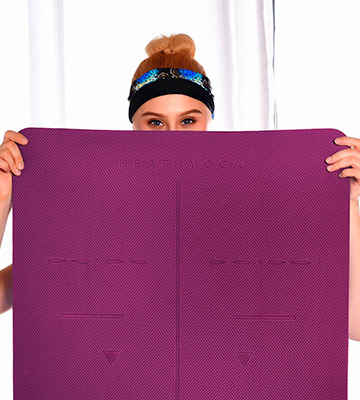
The width and height of the screenshot is (360, 400). I want to click on purple yoga mat, so click(293, 182).